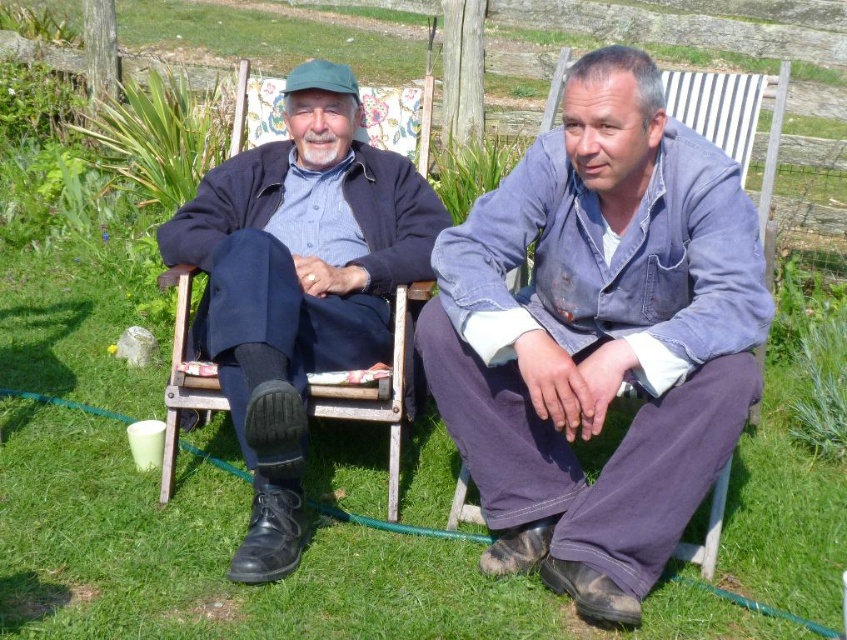
Question: In this image, where is denim jacket at center located relative to matte black jacket at left?

Choices:
 (A) below
 (B) above

Answer: (A)

Question: Does denim jacket at center appear under matte black jacket at left?

Choices:
 (A) yes
 (B) no

Answer: (A)

Question: Which point is closer to the camera?

Choices:
 (A) (558, 554)
 (B) (292, 392)

Answer: (B)

Question: In this image, where is denim jacket at center located relative to matte black jacket at left?

Choices:
 (A) above
 (B) below

Answer: (B)